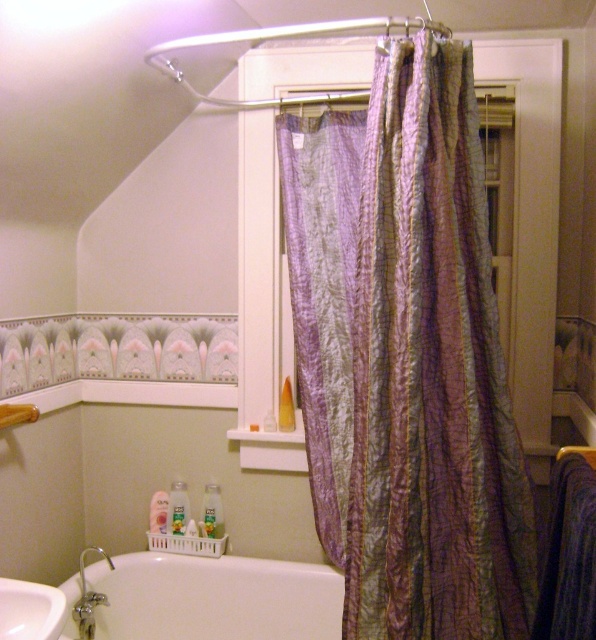
Between white glossy sink at lower left and wooden towel bar at lower left, which one is positioned lower?

Positioned lower is white glossy sink at lower left.

Describe the element at coordinates (29, 611) in the screenshot. Image resolution: width=596 pixels, height=640 pixels. I see `white glossy sink at lower left` at that location.

Locate an element on the screen. white glossy sink at lower left is located at coordinates click(x=29, y=611).

Can you confirm if white glossy sink at lower left is bigger than silver metallic faucet at lower left?

Incorrect, white glossy sink at lower left is not larger than silver metallic faucet at lower left.

Based on the photo, who is more forward, (8, 620) or (82, 589)?

Point (8, 620)

I want to click on white glossy sink at lower left, so click(29, 611).

Can you confirm if purple textured fabric at center is positioned to the right of white glossy sink at lower left?

Correct, you'll find purple textured fabric at center to the right of white glossy sink at lower left.

Does point (423, 276) lie behind point (7, 586)?

No, it is in front of (7, 586).

Identify the location of purple textured fabric at center. This screenshot has width=596, height=640. (430, 376).